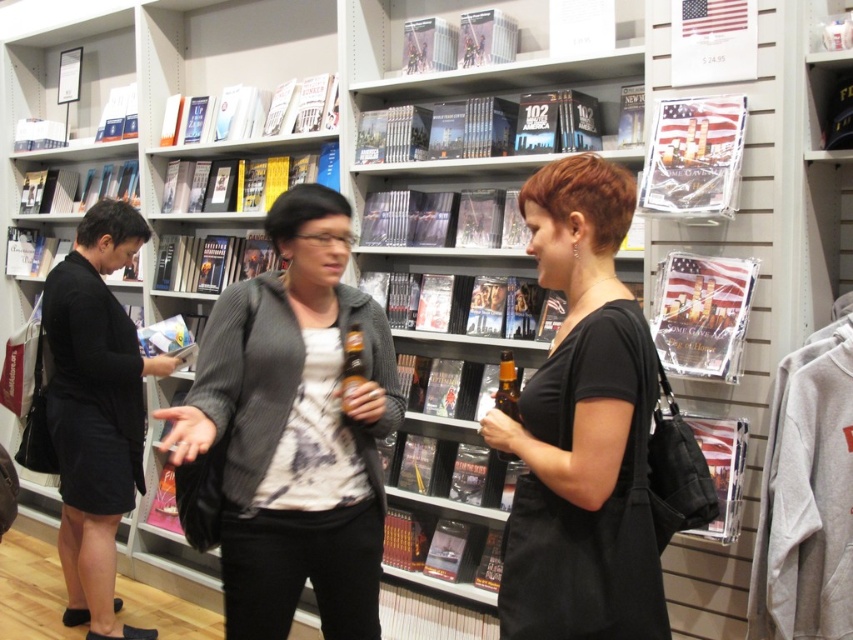
You are a store employee who needs to place a new book display between the gray textured jacket at center and the black matte dress at left. The display requires a minimum of 1.5 meters of space. Can you fit it there?

The distance between the gray textured jacket at center and the black matte dress at left is 1.26 meters, which is less than the required 1.5 meters. Therefore, the display cannot be placed there.

You are standing in the bookstore and want to know which of the two points, point (314, 364) or point (590, 624), is closer to you. Which one is closer?

Point (314, 364) is closer to you because it is further to the camera than point (590, 624).

You are a customer in the bookstore and you want to find the tallest clothing item between the black matte shirt at center and the black matte dress at left. Which one should you choose?

The black matte dress at left is taller than the black matte shirt at center, so you should choose the black matte dress at left.